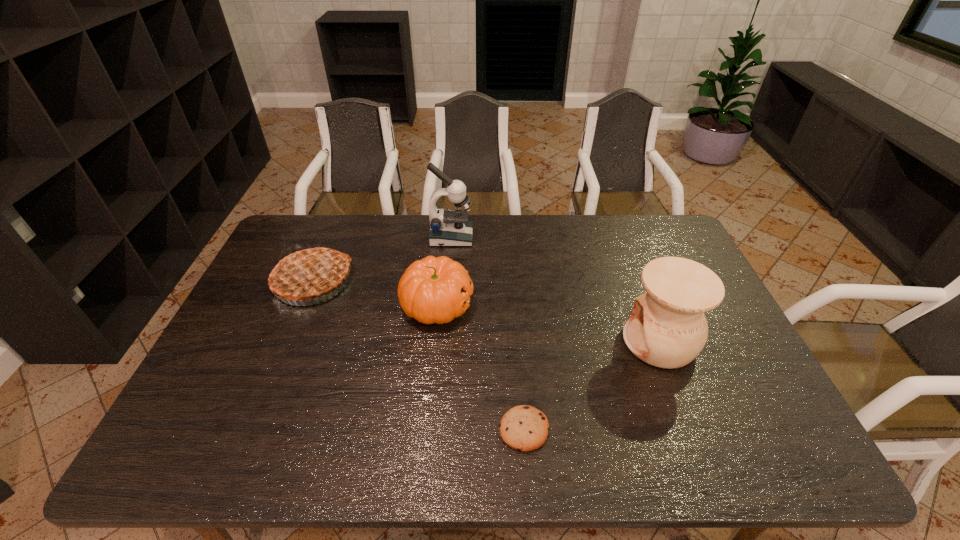
Where is `vacant region between the pumpkin and the pie`? This screenshot has width=960, height=540. vacant region between the pumpkin and the pie is located at coordinates (375, 293).

Locate an element on the screen. This screenshot has height=540, width=960. vacant region between the farthest object and the leftmost object is located at coordinates (382, 259).

You are a GUI agent. You are given a task and a screenshot of the screen. Output one action in this format:
    pyautogui.click(x=<x>, y=<y>)
    Task: Click on the blank region between the pumpkin and the fourth shortest object
    Image resolution: width=960 pixels, height=540 pixels.
    Given the screenshot: What is the action you would take?
    (548, 323)

Where is `free area in between the third tallest object and the shortest object`? Image resolution: width=960 pixels, height=540 pixels. free area in between the third tallest object and the shortest object is located at coordinates (419, 355).

The image size is (960, 540). What are the coordinates of `free space between the fourth tallest object and the nearest object` in the screenshot? It's located at (480, 367).

Image resolution: width=960 pixels, height=540 pixels. Find the location of `the second closest object to the pottery`. the second closest object to the pottery is located at coordinates (432, 290).

In order to click on object that is the second nearest to the shortest object in this screenshot , I will do `click(667, 328)`.

Image resolution: width=960 pixels, height=540 pixels. Identify the location of free point that satisfies the following two spatial constraints: 1. on the back side of the nearest object; 2. on the carved face of the pumpkin. (514, 305).

You are a GUI agent. You are given a task and a screenshot of the screen. Output one action in this format:
    pyautogui.click(x=<x>, y=<y>)
    Task: Click on the vacant space that satisfies the following two spatial constraints: 1. on the carved face of the second shortest object; 2. on the right side of the nearest object
    This screenshot has width=960, height=540.
    Given the screenshot: What is the action you would take?
    pyautogui.click(x=424, y=429)

Identify the location of vacant space that satisfies the following two spatial constraints: 1. on the carved face of the shortest object; 2. on the right side of the pumpkin. (424, 429).